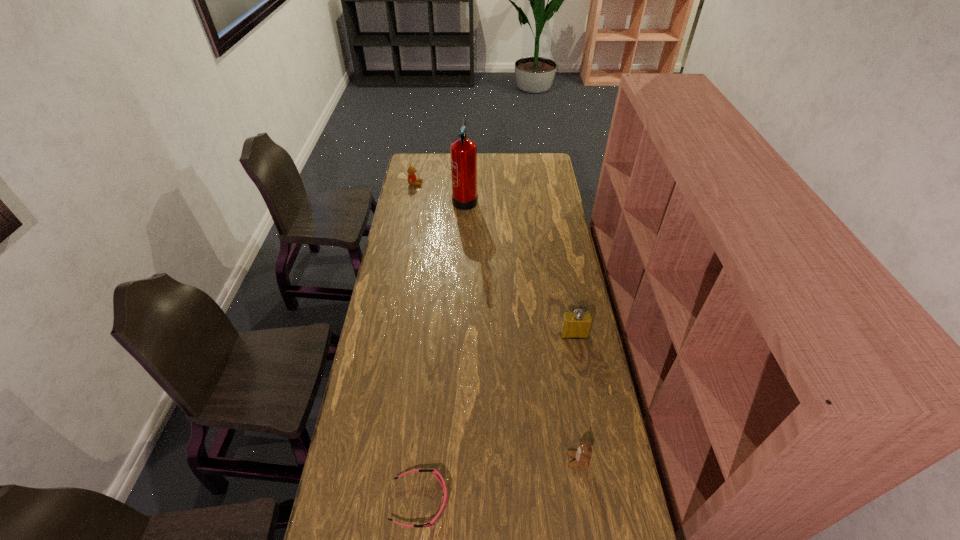
Find the location of a particular element. This screenshot has width=960, height=540. fire extinguisher is located at coordinates (463, 151).

Find the location of a particular element. This screenshot has height=540, width=960. perfume is located at coordinates point(577,324).

Identify the location of the fourth shortest object. This screenshot has height=540, width=960. (577, 324).

Image resolution: width=960 pixels, height=540 pixels. What are the coordinates of `the leftmost object` in the screenshot? It's located at (412, 179).

Locate an element on the screen. the left teddy bear is located at coordinates (412, 179).

The width and height of the screenshot is (960, 540). What are the coordinates of `the fourth tallest object` in the screenshot? It's located at (582, 456).

This screenshot has width=960, height=540. I want to click on the right teddy bear, so click(x=582, y=456).

Image resolution: width=960 pixels, height=540 pixels. I want to click on goggles, so click(x=432, y=523).

The image size is (960, 540). I want to click on vacant space positioned on the left of the fire extinguisher, so click(401, 198).

Find the location of `vacant space positioned 0.380m on the front-facing side of the perfume`. vacant space positioned 0.380m on the front-facing side of the perfume is located at coordinates (592, 433).